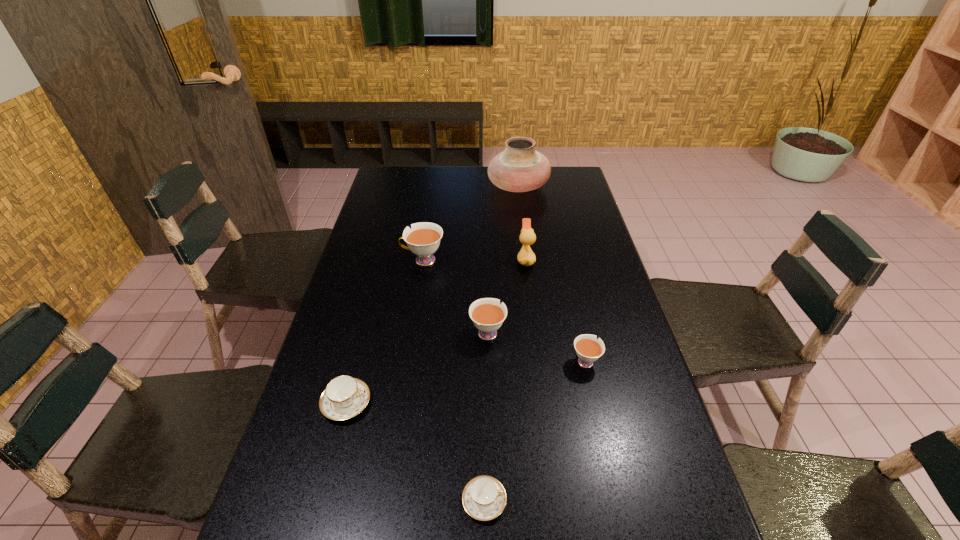
Where is `the fourth farthest teacup`? This screenshot has width=960, height=540. the fourth farthest teacup is located at coordinates (344, 397).

Locate an element on the screen. the shortest teacup is located at coordinates (484, 498).

You are a GUI agent. You are given a task and a screenshot of the screen. Output one action in this format:
    pyautogui.click(x=<x>, y=<y>)
    Task: Click on the smaller blue teacup
    The image size is (960, 540).
    Given the screenshot: What is the action you would take?
    pyautogui.click(x=484, y=498)

In order to click on vacant point located 0.210m on the left of the pottery in this screenshot , I will do `click(438, 187)`.

Where is `vacant region located 0.190m on the beak of the duck`? This screenshot has height=540, width=960. vacant region located 0.190m on the beak of the duck is located at coordinates (461, 260).

Identify the location of free region located 0.180m on the beak of the duck. (464, 260).

The width and height of the screenshot is (960, 540). Find the location of `blank space located 0.090m on the beak of the duck`. blank space located 0.090m on the beak of the duck is located at coordinates (491, 260).

At what (x,y) coordinates should I click in order to perform the action: click on vacant space located 0.150m on the side of the biggest white teacup with the handle. Please return your answer as a coordinate pair (x, y). Looking at the image, I should click on (357, 260).

Locate an element on the screen. vacant space located on the side of the biggest white teacup with the handle is located at coordinates coord(380,260).

Identify the location of vacant space located 0.050m on the side of the fourth shortest teacup with the handle. The image size is (960, 540). (488, 305).